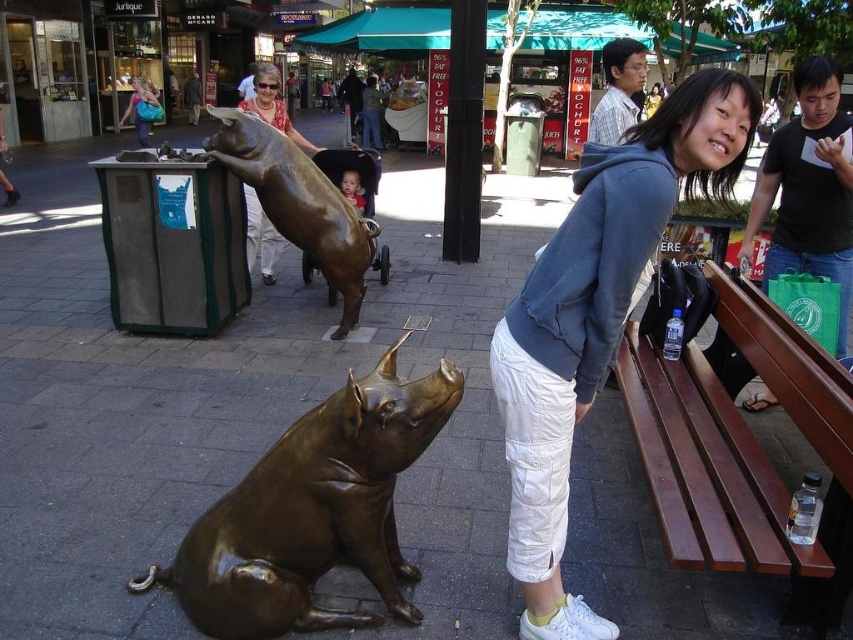
Consider the image. You are a delivery person who needs to place a package on the nearest available surface. You see the brown wood bench at right and the black matte bag at upper right. Which surface is closer to you?

The brown wood bench at right is closer to you as it is only 3.77 feet away from the black matte bag at upper right, so it is the nearest available surface.

You are a tourist visiting the shopping district and want to place your black matte bag at upper right on a bench to rest. Is the brown wood bench at right the correct one to use?

The brown wood bench at right is in front of the black matte bag at upper right, so the bench is located between the bag and the viewer. Therefore, the brown wood bench at right is the correct one to place the black matte bag at upper right on.